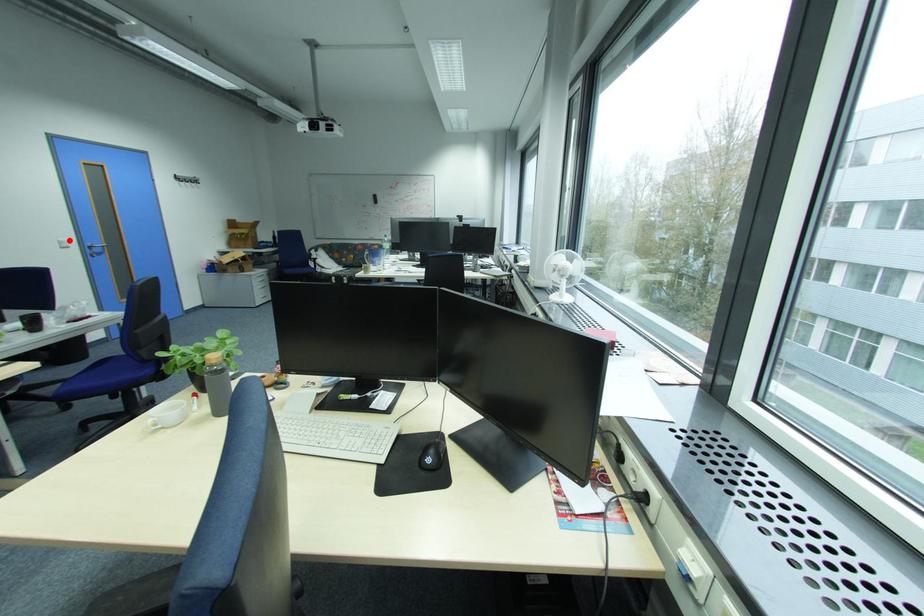
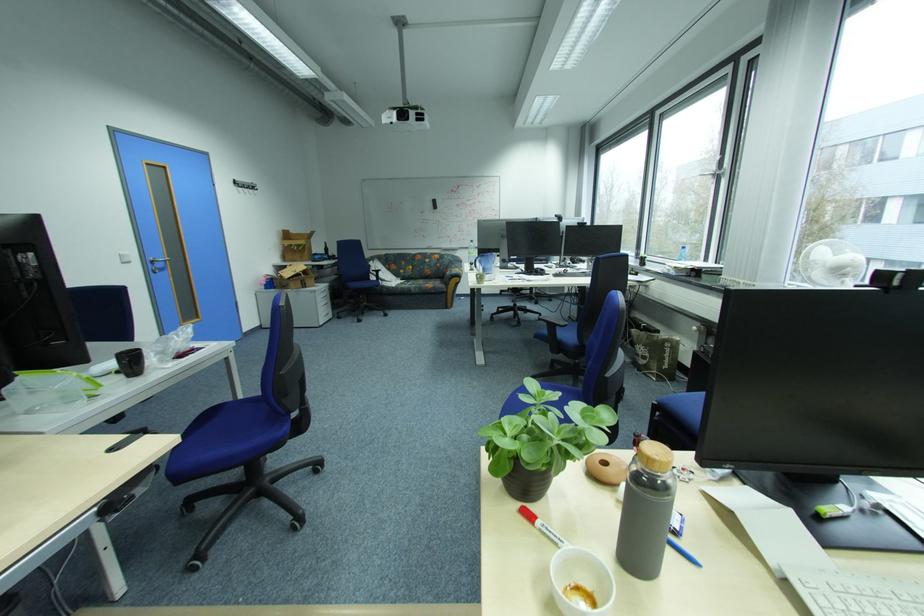
Question: I am providing you with two images of the same scene from different viewpoints. A red point is marked on the first image. Can you still see the location of the red point in image 2?

Choices:
 (A) Yes
 (B) No

Answer: (A)